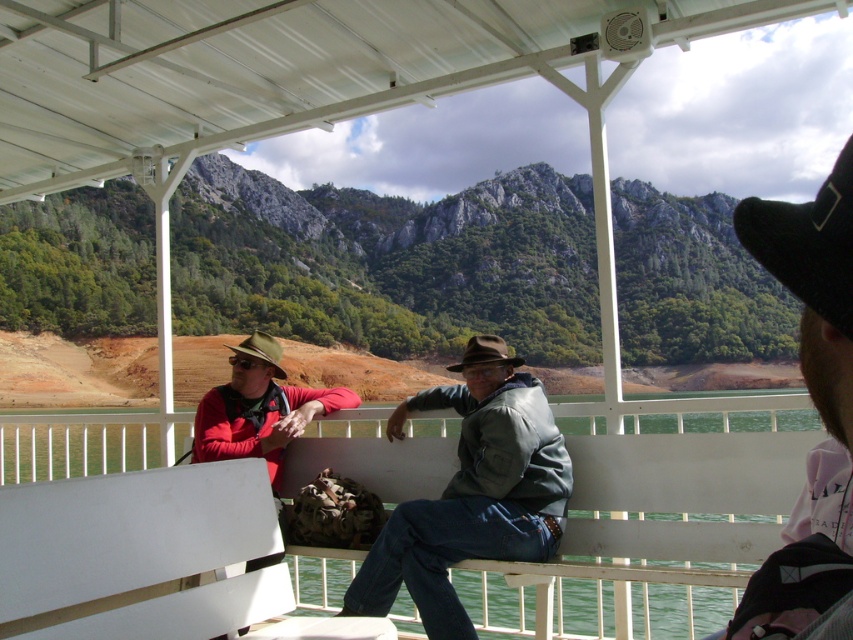
Can you confirm if green forested mountain at center is smaller than brown matte cowboy hat at center?

Incorrect, green forested mountain at center is not smaller in size than brown matte cowboy hat at center.

Measure the distance between green forested mountain at center and brown matte cowboy hat at center.

green forested mountain at center and brown matte cowboy hat at center are 430.49 feet apart.

Identify the location of green forested mountain at center. (389, 262).

Measure the distance between green matte jacket at center and black knitted cowboy hat at upper right.

green matte jacket at center is 3.11 meters from black knitted cowboy hat at upper right.

Where is `green matte jacket at center`? green matte jacket at center is located at coordinates (471, 499).

Which is more to the left, white plastic bench at center or black knitted cowboy hat at upper right?

white plastic bench at center is more to the left.

Between point (56, 420) and point (776, 225), which one is positioned behind?

Positioned behind is point (56, 420).

Where is `white plastic bench at center`? white plastic bench at center is located at coordinates (140, 552).